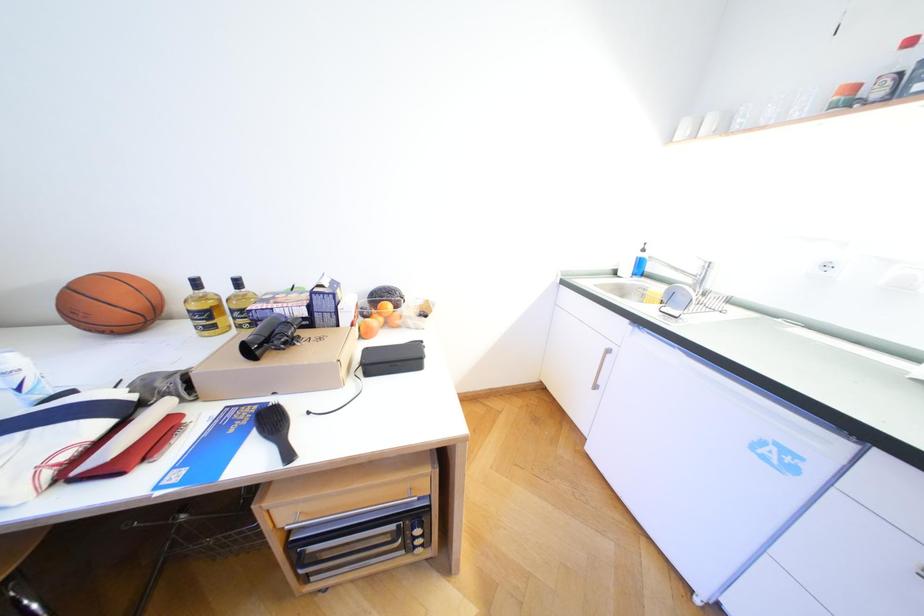
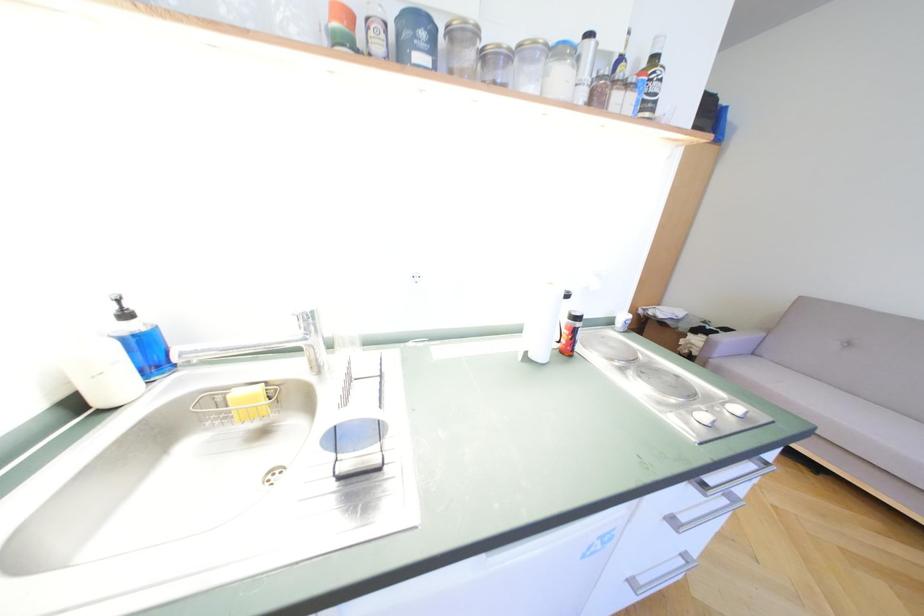
The images are taken continuously from a first-person perspective. In which direction is your viewpoint rotating?

The camera rotated toward right-down.